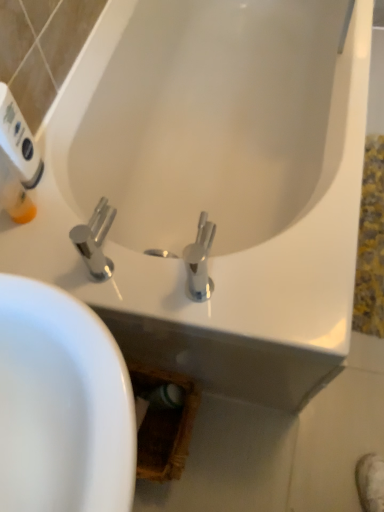
Question: Is polished chrome faucet at center wider than white plastic hand dryer at upper left?

Choices:
 (A) no
 (B) yes

Answer: (B)

Question: From a real-world perspective, is polished chrome faucet at center physically below white plastic hand dryer at upper left?

Choices:
 (A) yes
 (B) no

Answer: (A)

Question: Is polished chrome faucet at center facing towards white plastic hand dryer at upper left?

Choices:
 (A) yes
 (B) no

Answer: (B)

Question: From the image's perspective, is polished chrome faucet at center on white plastic hand dryer at upper left?

Choices:
 (A) yes
 (B) no

Answer: (B)

Question: Are polished chrome faucet at center and white plastic hand dryer at upper left making contact?

Choices:
 (A) yes
 (B) no

Answer: (B)

Question: Is polished chrome faucet at center turned away from white plastic hand dryer at upper left?

Choices:
 (A) no
 (B) yes

Answer: (A)

Question: Can you confirm if white plastic hand dryer at upper left is bigger than polished chrome faucet at center?

Choices:
 (A) no
 (B) yes

Answer: (A)

Question: Would you say white plastic hand dryer at upper left is outside polished chrome faucet at center?

Choices:
 (A) no
 (B) yes

Answer: (B)

Question: Is white plastic hand dryer at upper left thinner than polished chrome faucet at center?

Choices:
 (A) yes
 (B) no

Answer: (A)

Question: Is white plastic hand dryer at upper left wider than polished chrome faucet at center?

Choices:
 (A) yes
 (B) no

Answer: (B)

Question: Is white plastic hand dryer at upper left to the right of polished chrome faucet at center from the viewer's perspective?

Choices:
 (A) yes
 (B) no

Answer: (B)

Question: Is white plastic hand dryer at upper left facing towards polished chrome faucet at center?

Choices:
 (A) yes
 (B) no

Answer: (B)

Question: From the image's perspective, relative to white plastic hand dryer at upper left, is polished chrome faucet at center above or below?

Choices:
 (A) above
 (B) below

Answer: (B)